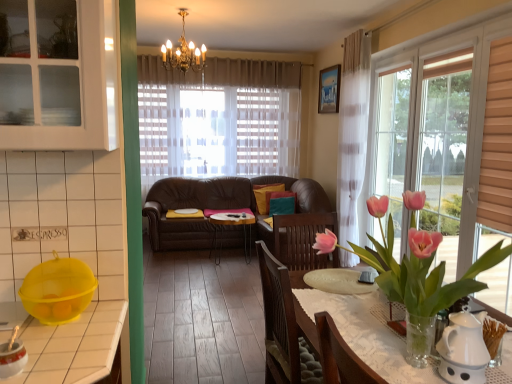
Question: Considering the positions of point (93, 36) and point (407, 168), is point (93, 36) closer or farther from the camera than point (407, 168)?

Choices:
 (A) closer
 (B) farther

Answer: (A)

Question: Looking at the image, does white glass cabinet at upper left seem bigger or smaller compared to transparent glass window at right?

Choices:
 (A) big
 (B) small

Answer: (B)

Question: In terms of height, does white glass cabinet at upper left look taller or shorter compared to transparent glass window at right?

Choices:
 (A) tall
 (B) short

Answer: (B)

Question: Is point (442, 188) closer or farther from the camera than point (74, 1)?

Choices:
 (A) closer
 (B) farther

Answer: (B)

Question: Considering the positions of transparent glass window at right and white glass cabinet at upper left in the image, is transparent glass window at right taller or shorter than white glass cabinet at upper left?

Choices:
 (A) short
 (B) tall

Answer: (B)

Question: From a real-world perspective, is transparent glass window at right positioned above or below white glass cabinet at upper left?

Choices:
 (A) below
 (B) above

Answer: (A)

Question: Would you say transparent glass window at right is inside or outside white glass cabinet at upper left?

Choices:
 (A) inside
 (B) outside

Answer: (B)